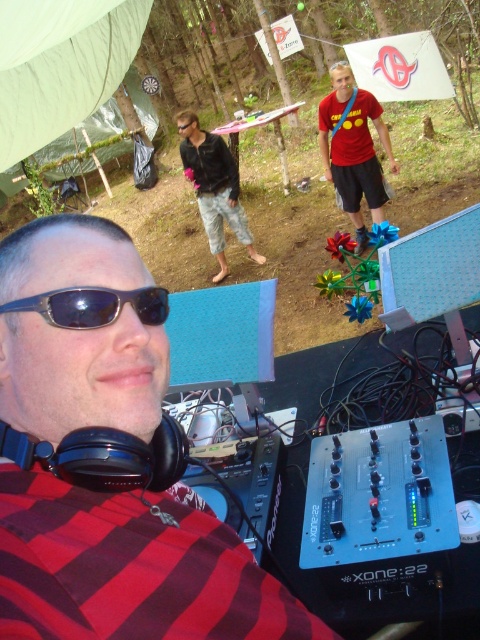
You are standing at the DJ equipment and want to reach the point marked at coordinates point (63,429). Given that the distance between you and the point is 24.90 inches, can you comfortably reach it without moving your feet?

The distance between you and the point marked at coordinates point (63,429) is 24.90 inches. Since the average human arm span is about 24 inches, you might need to stretch slightly but it should be reachable without moving your feet.

You are a photographer at the music festival trying to capture the DJ and the crowd. You notice two points in the scene at coordinates point (211, 144) and point (40, 300). Which point is closer to your camera lens?

Point (211, 144) is further to the camera than point (40, 300), so the point closer to the camera lens is point (40, 300).